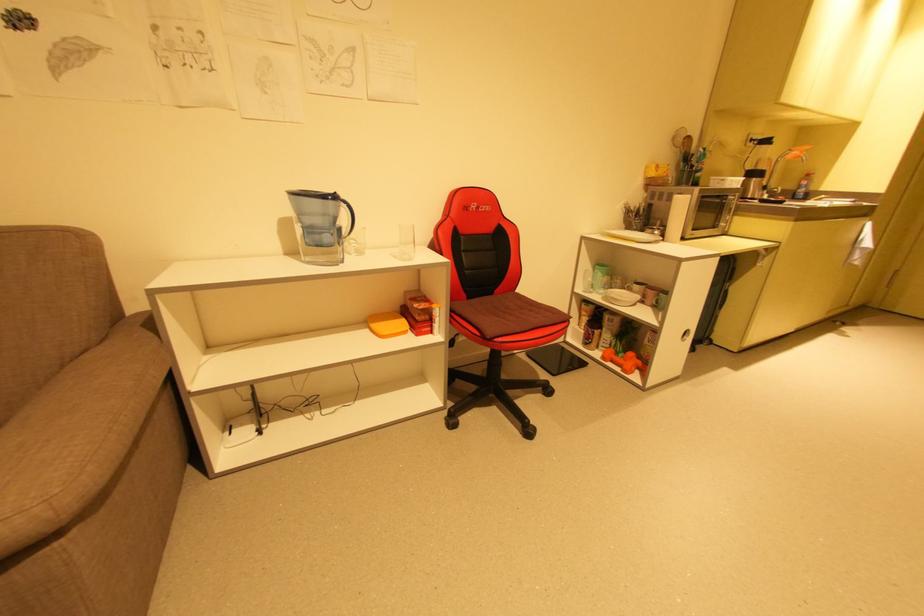
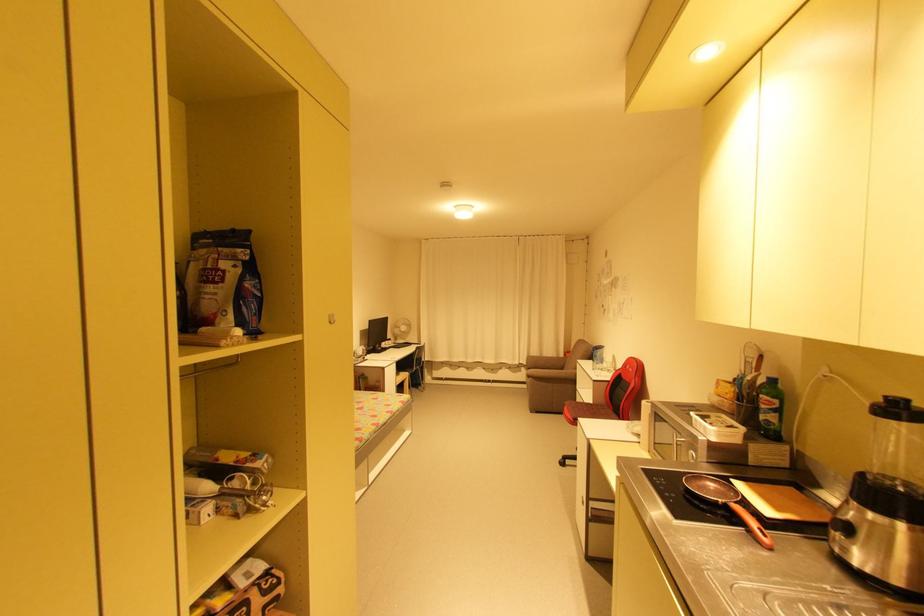
Where in the second image is the point corresponding to [478,207] from the first image?

(631, 367)